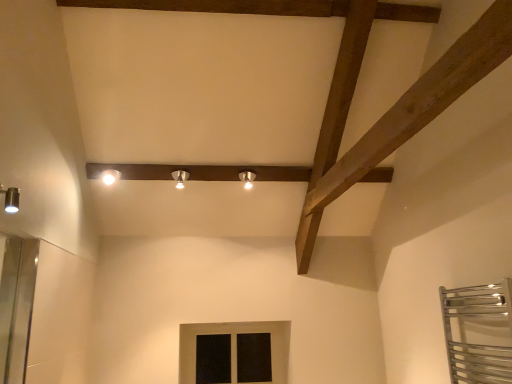
Question: Would you say black glass window at center is inside or outside matte silver spotlight at center, marked as the 2th light fixture in a right-to-left arrangement?

Choices:
 (A) inside
 (B) outside

Answer: (B)

Question: Based on their sizes in the image, would you say black glass window at center is bigger or smaller than matte silver spotlight at center, marked as the 2th light fixture in a right-to-left arrangement?

Choices:
 (A) big
 (B) small

Answer: (A)

Question: Which object is the farthest from the matte silver spotlight at center, positioned as the 3th light fixture in left-to-right order?

Choices:
 (A) matte silver spotlight at center, marked as the 2th light fixture in a right-to-left arrangement
 (B) white glossy spotlight at upper center, the 1th light fixture positioned from the left
 (C) black glass window at center

Answer: (C)

Question: Which object is positioned closest to the matte silver spotlight at center, positioned as the 2th light fixture in left-to-right order?

Choices:
 (A) matte silver spotlight at center, the 1th light fixture positioned from the right
 (B) black glass window at center
 (C) white glossy spotlight at upper center, placed as the third light fixture when sorted from right to left

Answer: (A)